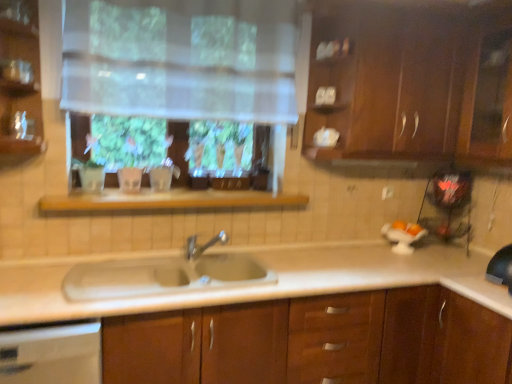
Question: Is translucent fabric at upper center wider or thinner than wooden shelf at center?

Choices:
 (A) thin
 (B) wide

Answer: (A)

Question: Is translucent fabric at upper center taller or shorter than wooden shelf at center?

Choices:
 (A) short
 (B) tall

Answer: (B)

Question: Considering the real-world distances, which object is closest to the wooden shelf at center?

Choices:
 (A) silver metallic faucet at center
 (B) dark wood cabinet at upper right, marked as the 2th cabinetry in a bottom-to-top arrangement
 (C) white glossy dishwasher at lower left
 (D) brown wood cabinet at center, which ranks as the second cabinetry in top-to-bottom order
 (E) white porcelain sink at center

Answer: (A)

Question: Which of these objects is positioned farthest from the white glossy dishwasher at lower left?

Choices:
 (A) white porcelain sink at center
 (B) silver metallic faucet at center
 (C) dark wood cabinet at upper right, marked as the 2th cabinetry in a bottom-to-top arrangement
 (D) brown wood cabinet at center, acting as the 1th cabinetry starting from the bottom
 (E) wooden shelf at center

Answer: (C)